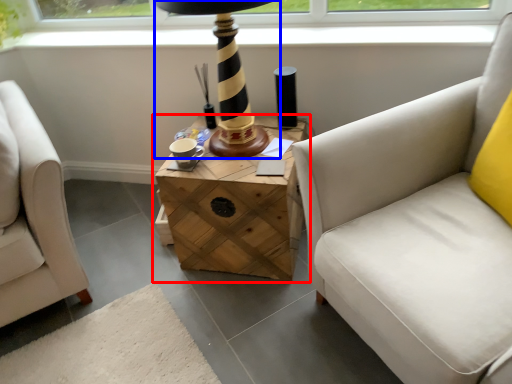
Question: Which point is closer to the camera, table (highlighted by a red box) or table lamp (highlighted by a blue box)?

Choices:
 (A) table
 (B) table lamp

Answer: (B)